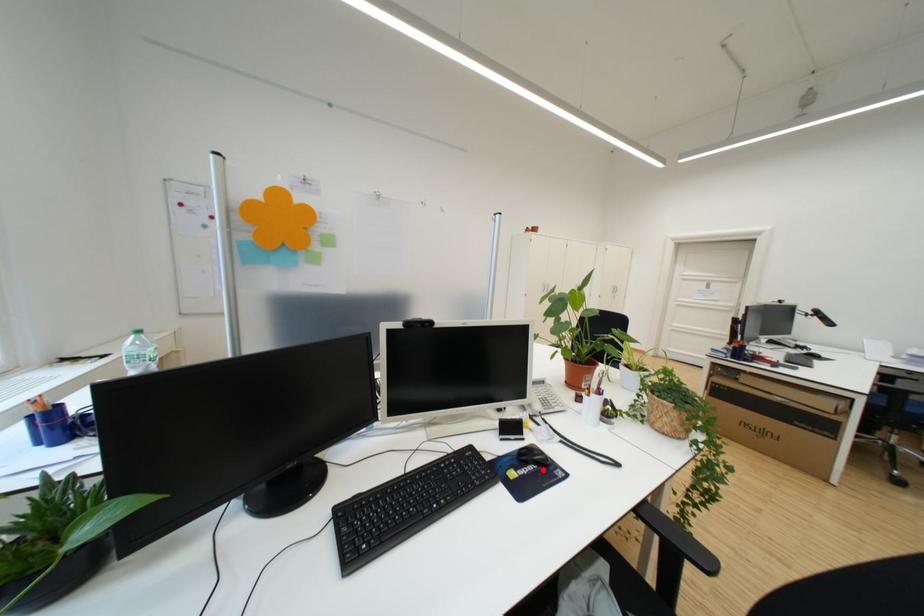
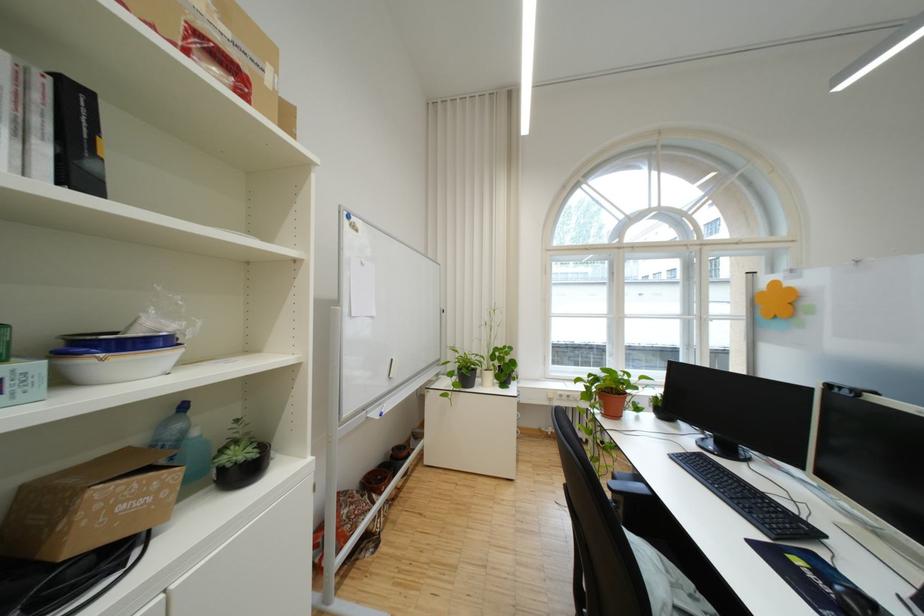
The point at the highlighted location is marked in the first image. Where is the corresponding point in the second image?

(841, 592)